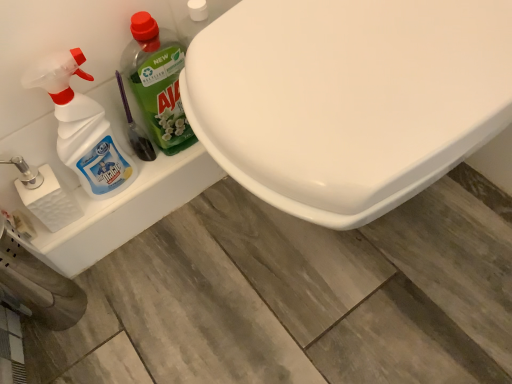
The height and width of the screenshot is (384, 512). In order to click on vacant space to the left of white glossy toilet at center in this screenshot , I will do (174, 299).